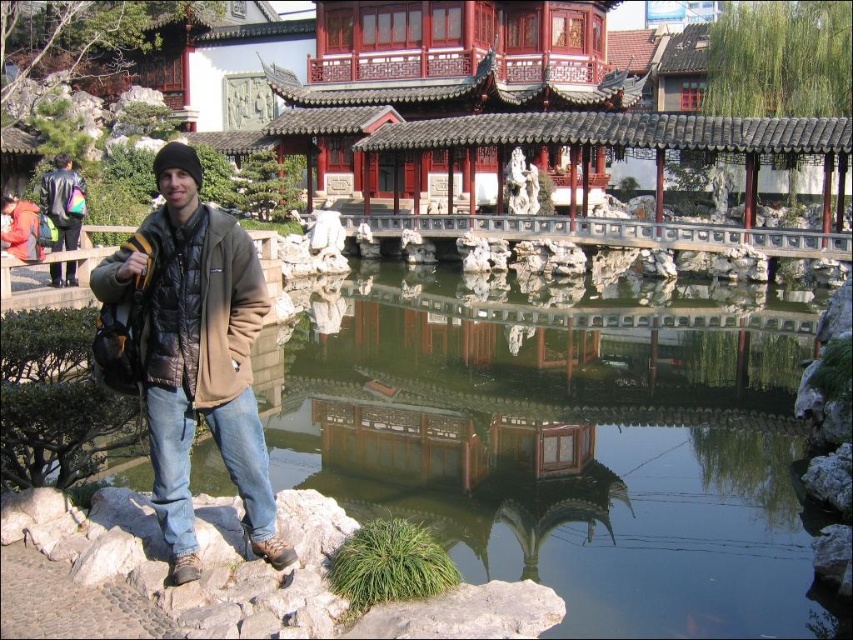
Between point (436, 496) and point (62, 244), which one is positioned behind?

Point (62, 244)

In order to click on transparent water at center in this screenshot , I will do `click(561, 444)`.

Is brown fuzzy jacket at lower left wider than matte black jacket at left?

No, brown fuzzy jacket at lower left is not wider than matte black jacket at left.

Is point (119, 300) more distant than point (70, 209)?

No.

Image resolution: width=853 pixels, height=640 pixels. I want to click on brown fuzzy jacket at lower left, so click(x=202, y=368).

Is gray rock at lower left above matte black jacket at left?

No, gray rock at lower left is not above matte black jacket at left.

Identify the location of gray rock at lower left. The width and height of the screenshot is (853, 640). (219, 579).